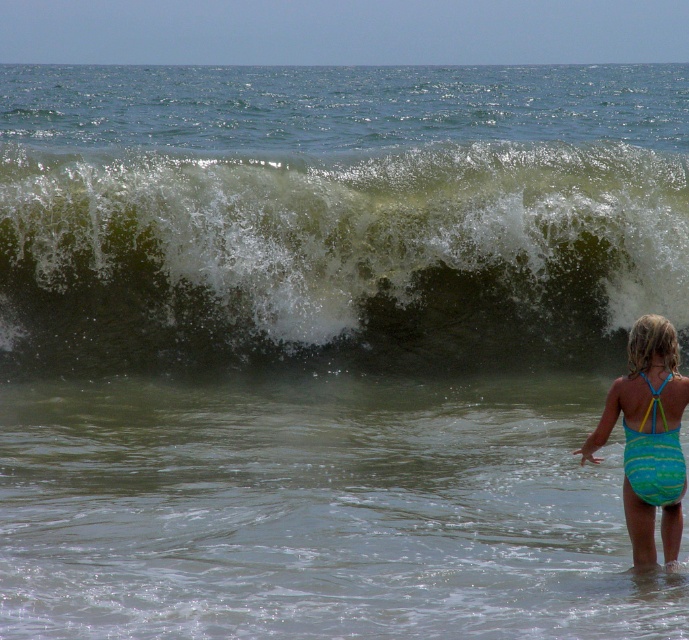
Question: Among these points, which one is farthest from the camera?

Choices:
 (A) (650, 333)
 (B) (85, 172)

Answer: (B)

Question: Is greenish-brown foam at upper center in front of blue striped swimsuit at lower right?

Choices:
 (A) no
 (B) yes

Answer: (A)

Question: Which object is farther from the camera taking this photo?

Choices:
 (A) greenish-brown foam at upper center
 (B) blue striped swimsuit at lower right

Answer: (A)

Question: Does greenish-brown foam at upper center have a larger size compared to blue striped swimsuit at lower right?

Choices:
 (A) no
 (B) yes

Answer: (B)

Question: Does greenish-brown foam at upper center appear on the left side of blue striped swimsuit at lower right?

Choices:
 (A) no
 (B) yes

Answer: (B)